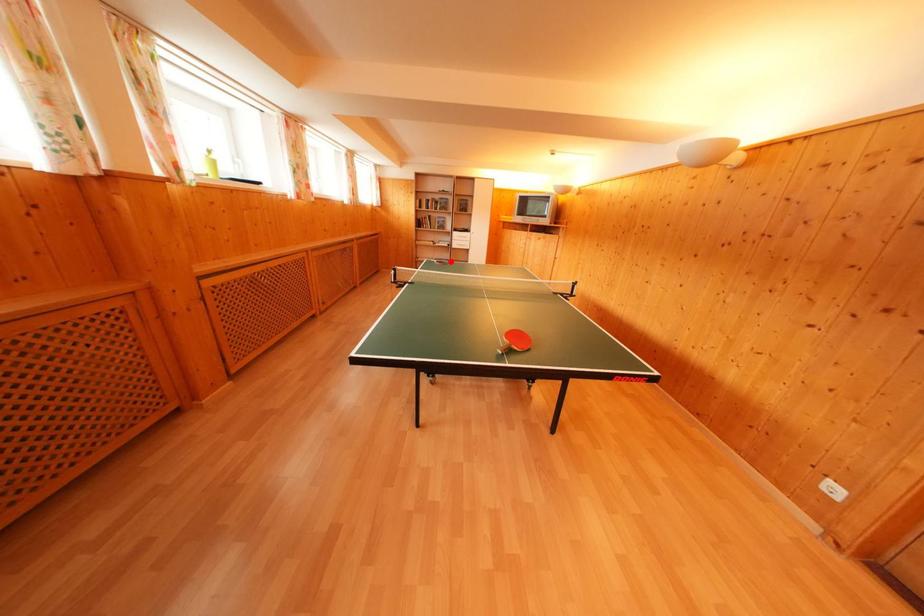
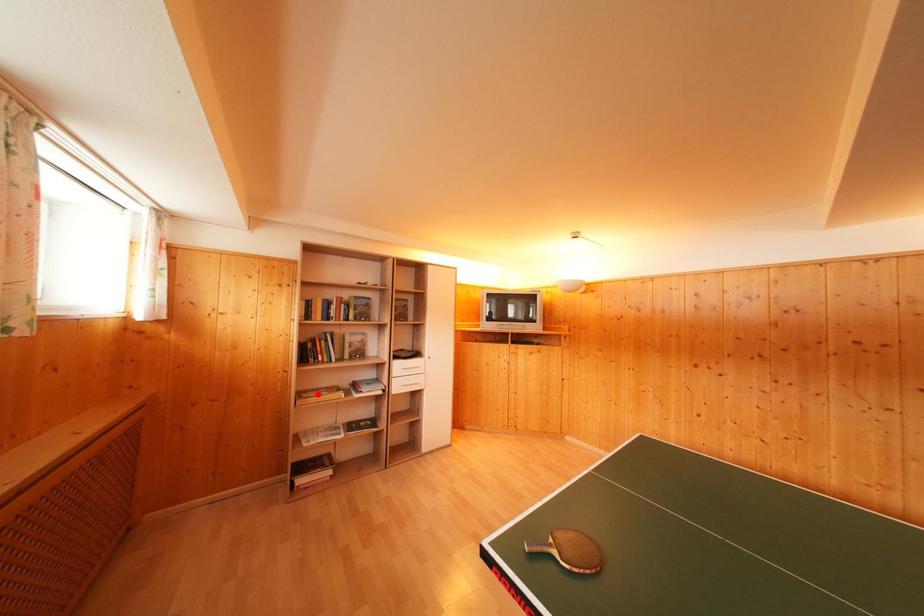
I am providing you with two images of the same scene from different viewpoints. A red point is marked on the first image and another point is marked on the second image. Is the marked point in image1 the same physical position as the marked point in image2?

No